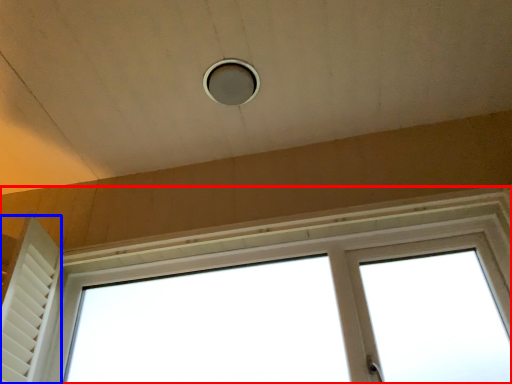
Question: Which of the following is the farthest to the observer, window (highlighted by a red box) or shutter (highlighted by a blue box)?

Choices:
 (A) window
 (B) shutter

Answer: (B)